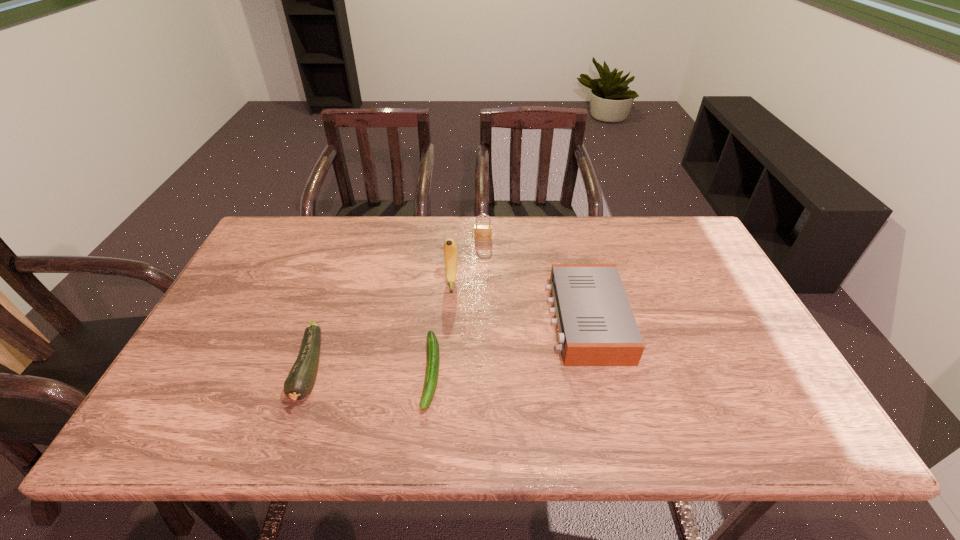
The image size is (960, 540). I want to click on banana, so click(450, 248).

The height and width of the screenshot is (540, 960). In order to click on the second object from right to left in this screenshot , I will do `click(482, 232)`.

Find the location of a particular element. Image resolution: width=960 pixels, height=540 pixels. the fourth shortest object is located at coordinates (482, 232).

Identify the location of the rightmost object. (596, 326).

This screenshot has height=540, width=960. Identify the location of the leftmost object. (301, 378).

Locate an element on the screen. the taller zucchini is located at coordinates (301, 378).

The image size is (960, 540). Identify the location of the shortest object. (433, 359).

The height and width of the screenshot is (540, 960). What are the coordinates of `the right zucchini` in the screenshot? It's located at click(433, 359).

Locate an element on the screen. This screenshot has height=540, width=960. vacant space situated 0.350m from the stem of the tallest object is located at coordinates (444, 401).

Where is `vacant region located on the front-facing side of the padlock`? vacant region located on the front-facing side of the padlock is located at coordinates (484, 323).